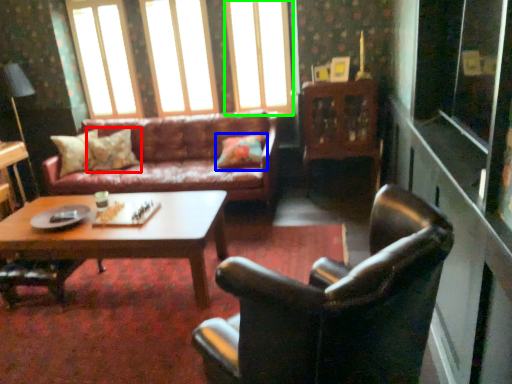
Question: Based on their relative distances, which object is nearer to pillow (highlighted by a red box)? Choose from pillow (highlighted by a blue box) and window (highlighted by a green box).

Choices:
 (A) pillow
 (B) window

Answer: (A)